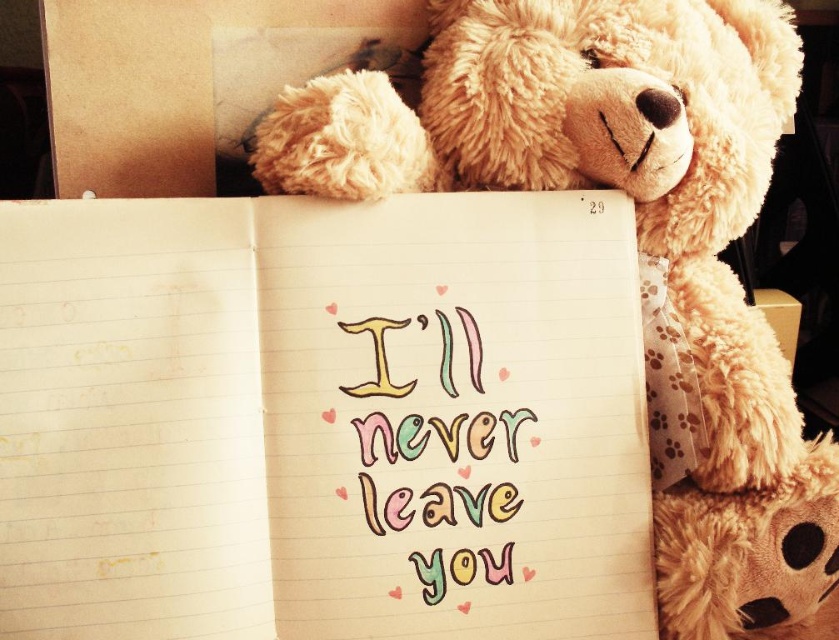
Question: Does fluffy beige teddy bear at upper right appear over pastel-colored handwriting at center?

Choices:
 (A) yes
 (B) no

Answer: (A)

Question: Which of the following is the closest to the observer?

Choices:
 (A) (478, 428)
 (B) (308, 620)
 (C) (662, 120)

Answer: (B)

Question: Considering the relative positions of yellow lined paper at upper center and fluffy beige teddy bear at upper right in the image provided, where is yellow lined paper at upper center located with respect to fluffy beige teddy bear at upper right?

Choices:
 (A) left
 (B) right

Answer: (A)

Question: Does fluffy beige teddy bear at upper right appear under pastel-colored handwriting at center?

Choices:
 (A) yes
 (B) no

Answer: (B)

Question: Among these points, which one is farthest from the camera?

Choices:
 (A) (741, 524)
 (B) (399, 429)

Answer: (A)

Question: Which object appears closest to the camera in this image?

Choices:
 (A) yellow lined paper at upper center
 (B) fluffy beige teddy bear at upper right
 (C) pastel-colored handwriting at center

Answer: (A)